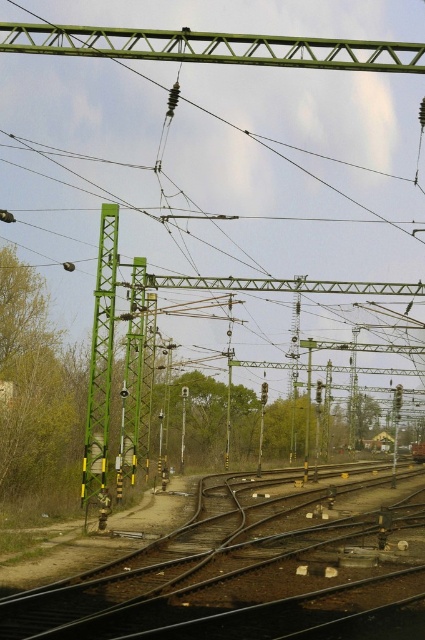
You are a maintenance worker inspecting the railway. You notice the dark brown metal train track at center and the green matte pole at center. Which object is closer to the ground?

The dark brown metal train track at center has a lesser height compared to the green matte pole at center, so the dark brown metal train track at center is closer to the ground.